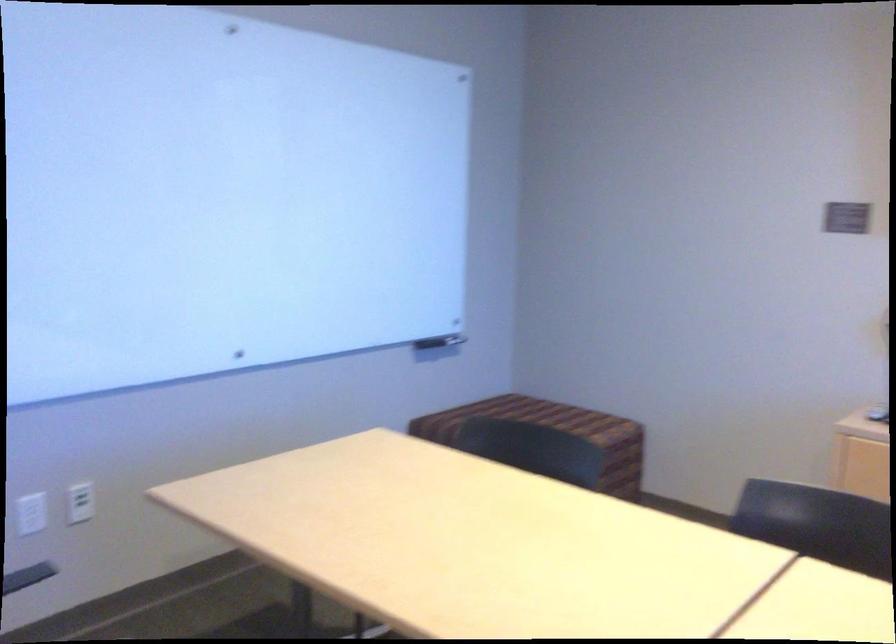
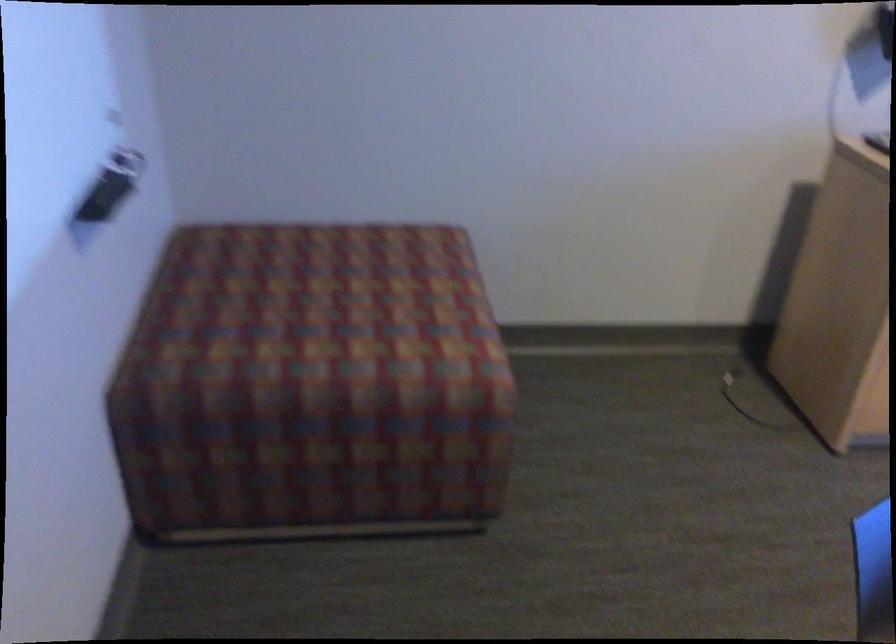
Locate, in the second image, the point that corresponds to point 524,418 in the first image.

(332, 301)